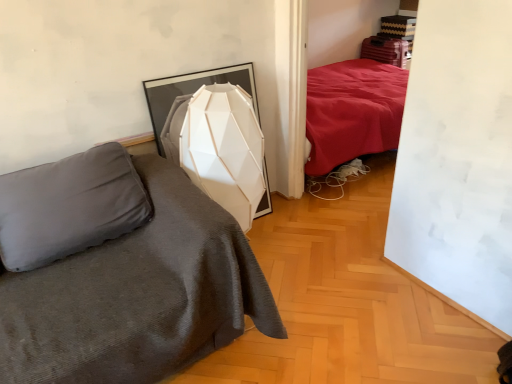
Measure the distance between dark gray fabric bed at left and camera.

dark gray fabric bed at left and camera are 1.35 meters apart from each other.

The width and height of the screenshot is (512, 384). Find the location of `dark gray fabric bed at left`. dark gray fabric bed at left is located at coordinates (137, 295).

The image size is (512, 384). What do you see at coordinates (137, 295) in the screenshot?
I see `dark gray fabric bed at left` at bounding box center [137, 295].

The width and height of the screenshot is (512, 384). I want to click on dark gray fabric bed at left, so click(137, 295).